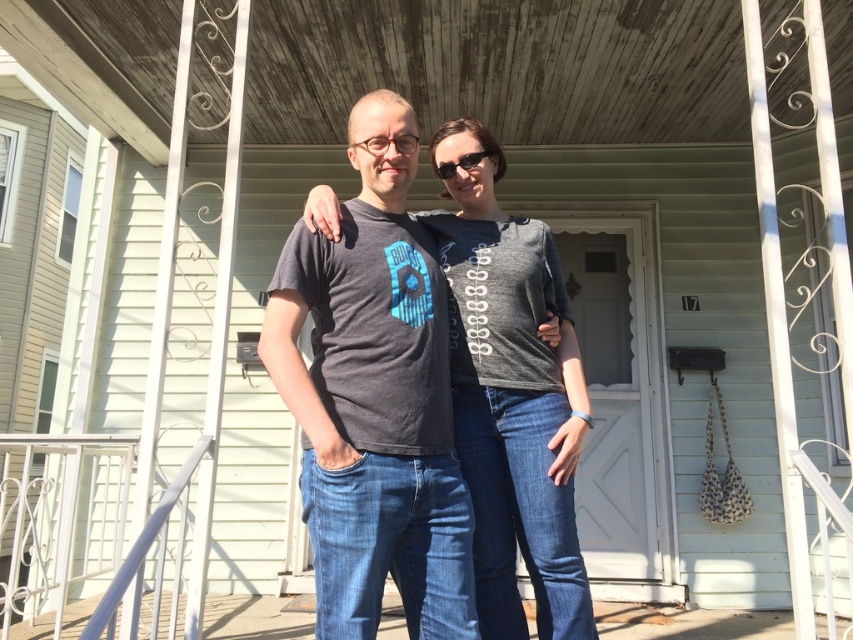
Does point (361, 326) come farther from viewer compared to point (466, 163)?

That is False.

Can you confirm if dark gray t-shirt at center is bigger than black plastic sunglasses at center?

Correct, dark gray t-shirt at center is larger in size than black plastic sunglasses at center.

Identify the location of dark gray t-shirt at center. The image size is (853, 640). (374, 400).